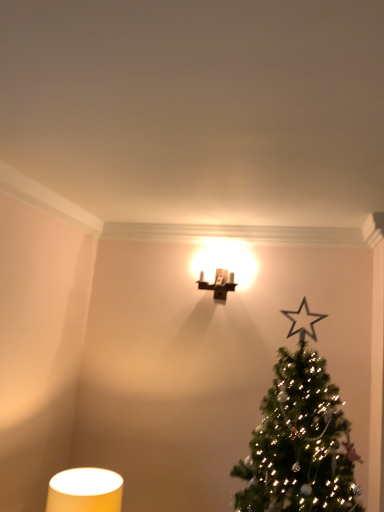
Question: From the image's perspective, relative to green matte christmas tree at upper right, is matte yellow cylindrical lampshade at lower left, arranged as the 1th table lamp when viewed from the front, above or below?

Choices:
 (A) above
 (B) below

Answer: (B)

Question: Is matte yellow cylindrical lampshade at lower left, which appears as the second table lamp when viewed from the top, wider or thinner than green matte christmas tree at upper right?

Choices:
 (A) wide
 (B) thin

Answer: (B)

Question: Estimate the real-world distances between objects in this image. Which object is closer to the matte yellow cylindrical lampshade at lower left, placed as the 1th table lamp when sorted from left to right?

Choices:
 (A) green matte christmas tree at upper right
 (B) matte brown wall sconce at upper center, placed as the 1th table lamp when sorted from back to front

Answer: (A)

Question: Based on their relative distances, which object is farther from the matte yellow cylindrical lampshade at lower left, placed as the 1th table lamp when sorted from left to right?

Choices:
 (A) green matte christmas tree at upper right
 (B) matte brown wall sconce at upper center, the 2th table lamp when ordered from bottom to top

Answer: (B)